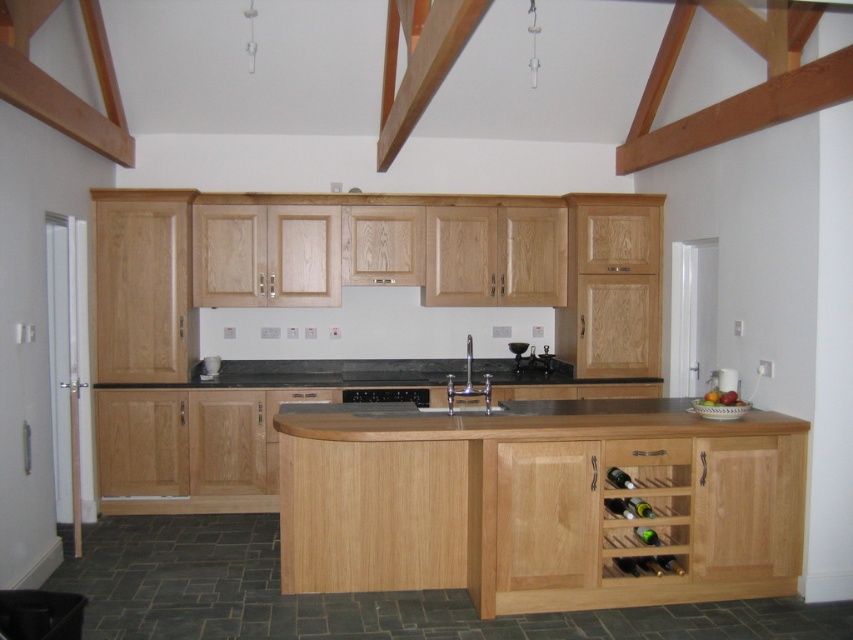
You are standing in the modern kitchen described and need to place a cutting board on the natural wood countertop at center. Given that the countertop is positioned at coordinates approximately 0.659 on the x and 0.613 on the y axis, can you confirm its location relative to the other kitchen elements?

The natural wood countertop at center is located at point (521, 420), which places it centrally within the kitchen space, making it an ideal spot for placing the cutting board.

You are standing at the entrance of the kitchen and want to place a large pot on the natural wood countertop at center. Based on its position, can you estimate where in the kitchen this countertop is located?

The natural wood countertop at center is located at point 0.613 on the y axis and 0.659 on the x axis, so it is positioned towards the lower right of the kitchen.